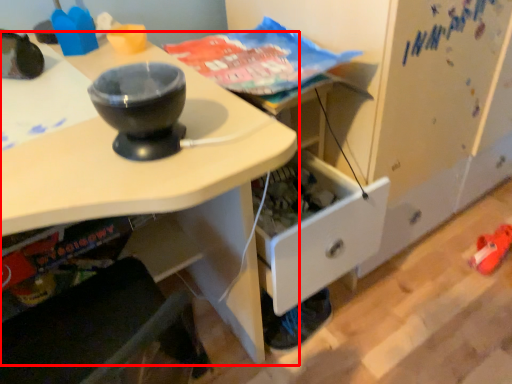
Question: In this image, where is desk (annotated by the red box) located relative to footwear?

Choices:
 (A) right
 (B) left

Answer: (B)